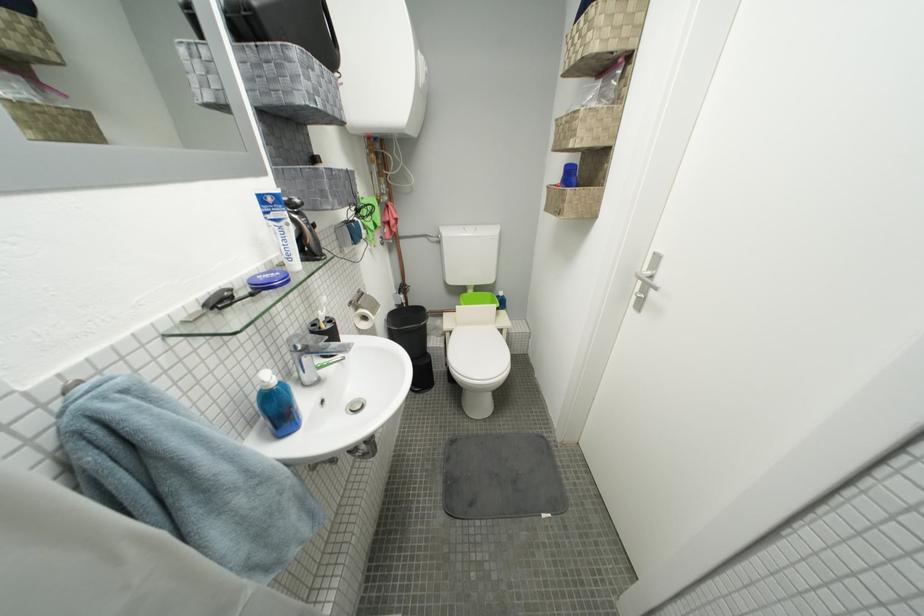
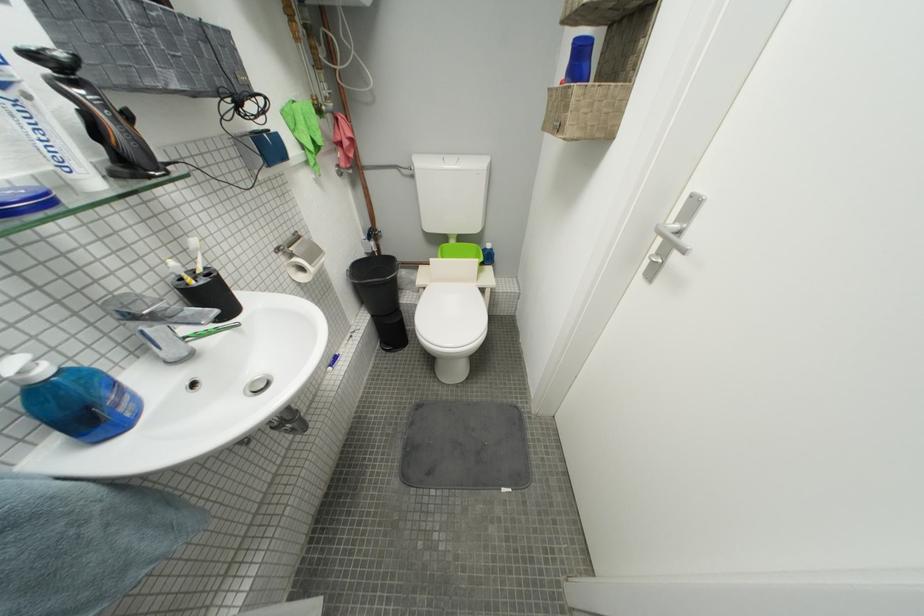
The point at (649, 286) is marked in the first image. Where is the corresponding point in the second image?

(669, 244)